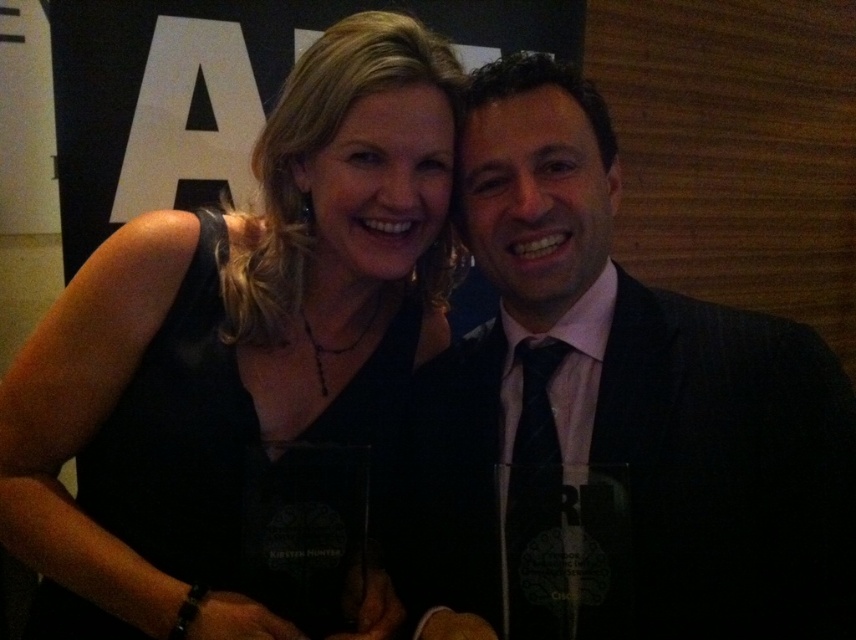
Consider the image. Is black suit at right wider than black matte dress at center?

No.

Is point (542, 616) positioned after point (67, 577)?

No, (542, 616) is in front of (67, 577).

This screenshot has width=856, height=640. I want to click on black suit at right, so click(615, 417).

Which is more to the left, black suit at right or black silk tie at center?

black silk tie at center is more to the left.

Does black suit at right appear on the right side of black silk tie at center?

Indeed, black suit at right is positioned on the right side of black silk tie at center.

Where is `black suit at right`? The width and height of the screenshot is (856, 640). black suit at right is located at coordinates (615, 417).

Which of these two, black matte dress at center or black silk tie at center, stands taller?

black matte dress at center

Does black matte dress at center have a lesser width compared to black silk tie at center?

No.

You are a GUI agent. You are given a task and a screenshot of the screen. Output one action in this format:
    pyautogui.click(x=<x>, y=<y>)
    Task: Click on the black matte dress at center
    The image size is (856, 640).
    Given the screenshot: What is the action you would take?
    pyautogui.click(x=235, y=340)

The image size is (856, 640). What are the coordinates of `black matte dress at center` in the screenshot? It's located at (235, 340).